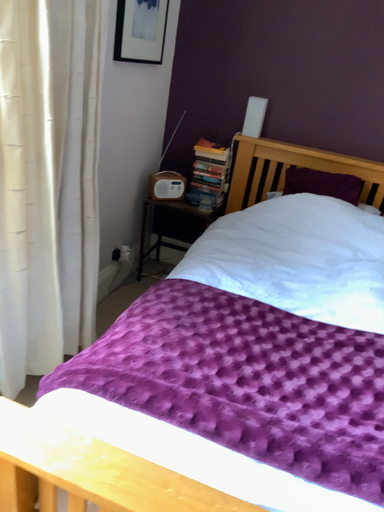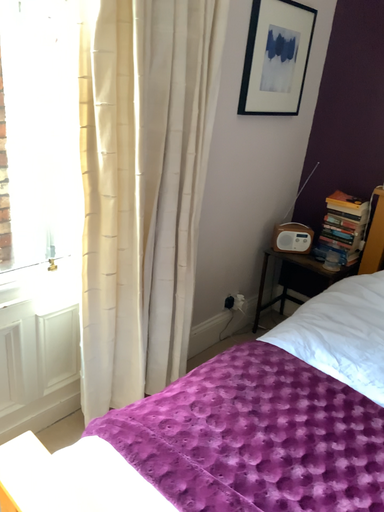
Question: How did the camera likely rotate when shooting the video?

Choices:
 (A) rotated upward
 (B) rotated downward

Answer: (A)